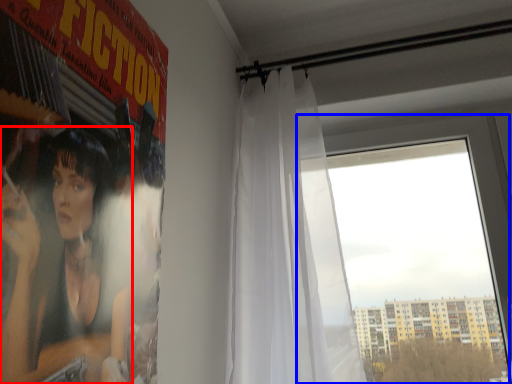
Question: Which point is further to the camera, person (highlighted by a red box) or window (highlighted by a blue box)?

Choices:
 (A) person
 (B) window

Answer: (B)